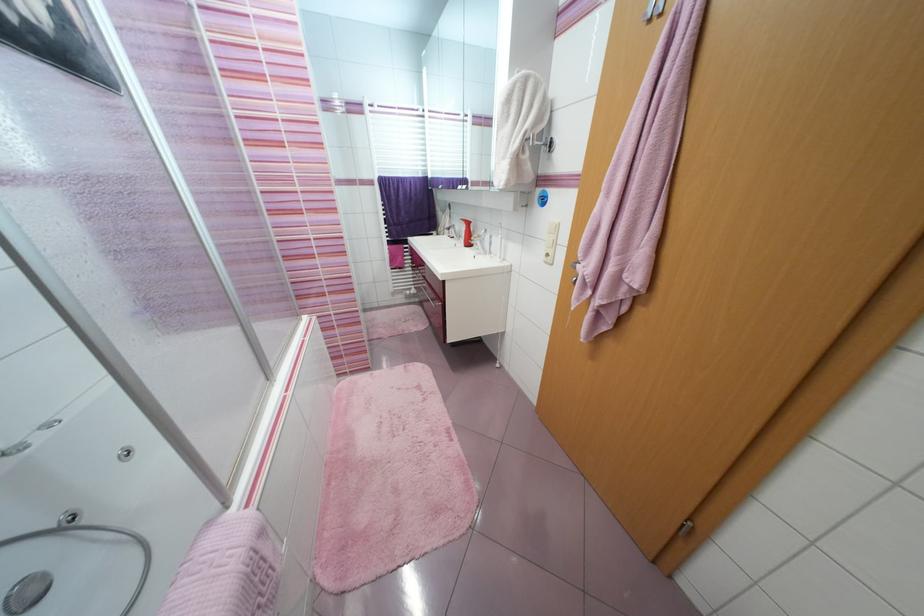
Locate an element on the screen. This screenshot has height=616, width=924. wall-mounted towel hook is located at coordinates (542, 143).